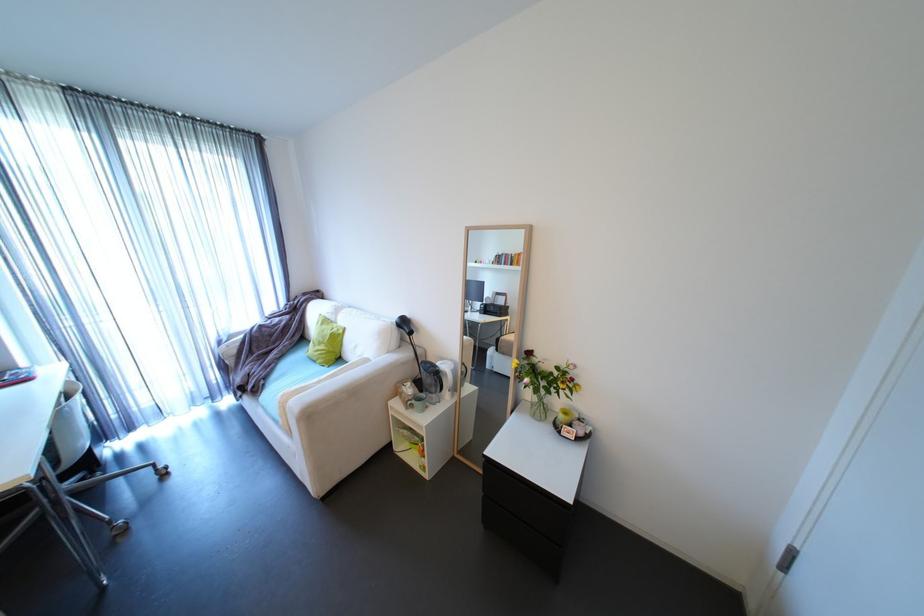
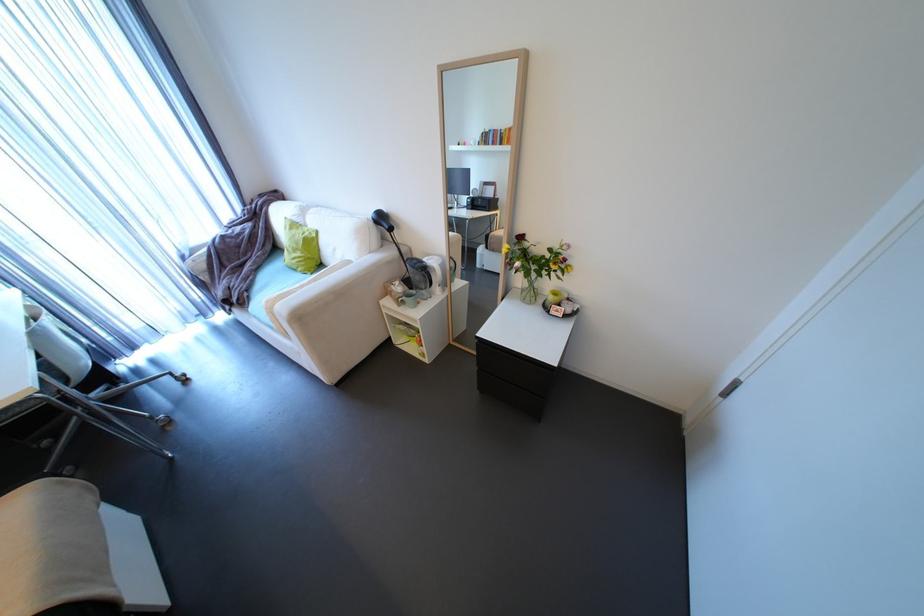
Locate, in the second image, the point that corresponds to (x=429, y=391) in the first image.

(419, 289)